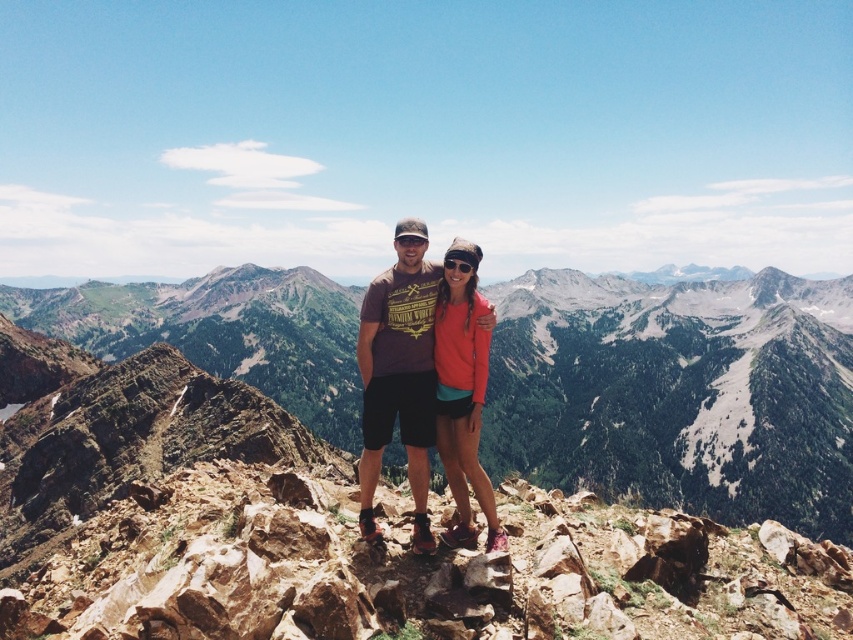
Based on the photo, between green grassy mountain at center and matte brown t-shirt at center, which one is positioned higher?

Positioned higher is green grassy mountain at center.

Who is positioned more to the left, green grassy mountain at center or matte brown t-shirt at center?

green grassy mountain at center is more to the left.

Is point (207, 348) closer to camera compared to point (403, 273)?

No, it is behind (403, 273).

Image resolution: width=853 pixels, height=640 pixels. I want to click on green grassy mountain at center, so click(677, 392).

Is green grassy mountain at center smaller than orange fleece jacket at center?

Actually, green grassy mountain at center might be larger than orange fleece jacket at center.

Find the location of `green grassy mountain at center`. green grassy mountain at center is located at coordinates (677, 392).

Is point (426, 268) positioned in front of point (463, 545)?

No, (426, 268) is behind (463, 545).

Is matte brown t-shirt at center thinner than orange fleece jacket at center?

No, matte brown t-shirt at center is not thinner than orange fleece jacket at center.

You are a GUI agent. You are given a task and a screenshot of the screen. Output one action in this format:
    pyautogui.click(x=<x>, y=<y>)
    Task: Click on the matte brown t-shirt at center
    This screenshot has width=853, height=640.
    Given the screenshot: What is the action you would take?
    pyautogui.click(x=399, y=374)

At what (x,y) coordinates should I click in order to perform the action: click on matte brown t-shirt at center. Please return your answer as a coordinate pair (x, y). Looking at the image, I should click on (399, 374).